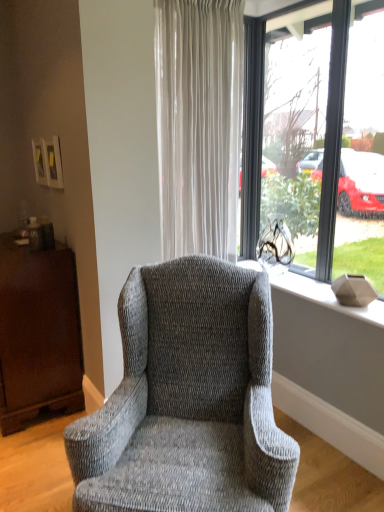
Question: Is textured gray wingback chair at center wider or thinner than matte gray vase at right?

Choices:
 (A) wide
 (B) thin

Answer: (A)

Question: From the image's perspective, is textured gray wingback chair at center above or below matte gray vase at right?

Choices:
 (A) above
 (B) below

Answer: (B)

Question: Which object is the closest to the white sheer curtain at center?

Choices:
 (A) matte gray vase at right
 (B) transparent glass window at center
 (C) mahogany wood dresser at left
 (D) textured gray wingback chair at center

Answer: (B)

Question: Based on their relative distances, which object is nearer to the mahogany wood dresser at left?

Choices:
 (A) white sheer curtain at center
 (B) textured gray wingback chair at center
 (C) transparent glass window at center
 (D) matte gray vase at right

Answer: (B)